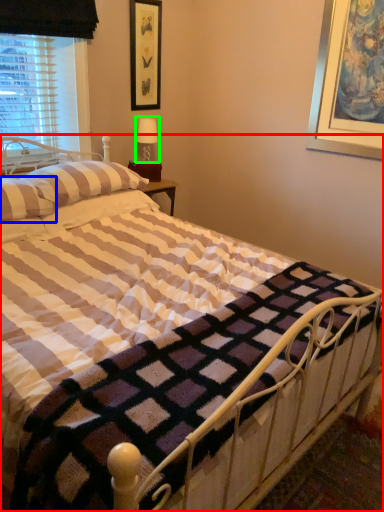
Question: Which object is positioned closest to bed (highlighted by a red box)? Select from pillow (highlighted by a blue box) and table lamp (highlighted by a green box).

Choices:
 (A) pillow
 (B) table lamp

Answer: (A)